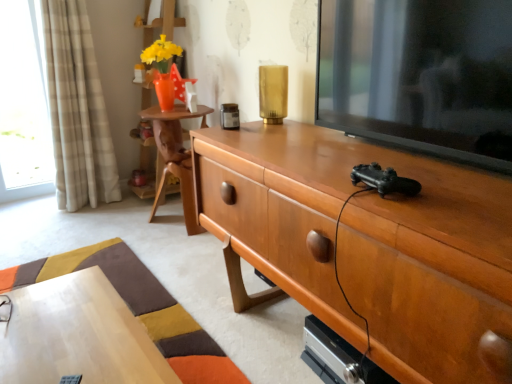
Question: Can you confirm if beige plaid curtain at left is taller than black glossy television at right?

Choices:
 (A) no
 (B) yes

Answer: (B)

Question: Is beige plaid curtain at left oriented towards black glossy television at right?

Choices:
 (A) no
 (B) yes

Answer: (A)

Question: From the image's perspective, is beige plaid curtain at left on top of black glossy television at right?

Choices:
 (A) yes
 (B) no

Answer: (A)

Question: From the image's perspective, is beige plaid curtain at left below black glossy television at right?

Choices:
 (A) yes
 (B) no

Answer: (B)

Question: Does beige plaid curtain at left have a smaller size compared to black glossy television at right?

Choices:
 (A) yes
 (B) no

Answer: (B)

Question: Can you confirm if beige plaid curtain at left is thinner than black glossy television at right?

Choices:
 (A) yes
 (B) no

Answer: (B)

Question: Can you confirm if woodenmaterial/texturebookshelf at upper left is positioned to the right of wooden cabinet at center?

Choices:
 (A) no
 (B) yes

Answer: (A)

Question: Is woodenmaterial/texturebookshelf at upper left bigger than wooden cabinet at center?

Choices:
 (A) yes
 (B) no

Answer: (B)

Question: Is woodenmaterial/texturebookshelf at upper left outside wooden cabinet at center?

Choices:
 (A) no
 (B) yes

Answer: (B)

Question: Considering the relative sizes of woodenmaterial/texturebookshelf at upper left and wooden cabinet at center in the image provided, is woodenmaterial/texturebookshelf at upper left thinner than wooden cabinet at center?

Choices:
 (A) yes
 (B) no

Answer: (A)

Question: Is woodenmaterial/texturebookshelf at upper left at the left side of wooden cabinet at center?

Choices:
 (A) no
 (B) yes

Answer: (B)

Question: Can you confirm if woodenmaterial/texturebookshelf at upper left is wider than wooden cabinet at center?

Choices:
 (A) no
 (B) yes

Answer: (A)

Question: Is clear glass window at left not inside woodenmaterial/texturebookshelf at upper left?

Choices:
 (A) yes
 (B) no

Answer: (A)